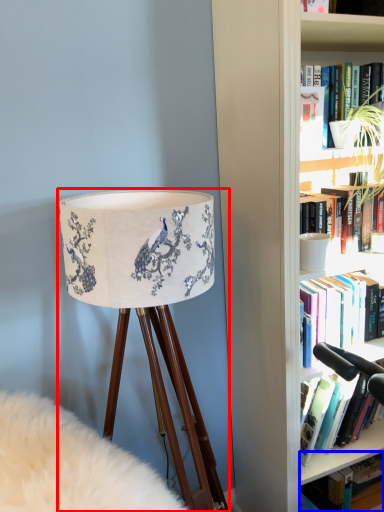
Question: Which object is further to the camera taking this photo, lamp (highlighted by a red box) or book (highlighted by a blue box)?

Choices:
 (A) lamp
 (B) book

Answer: (B)